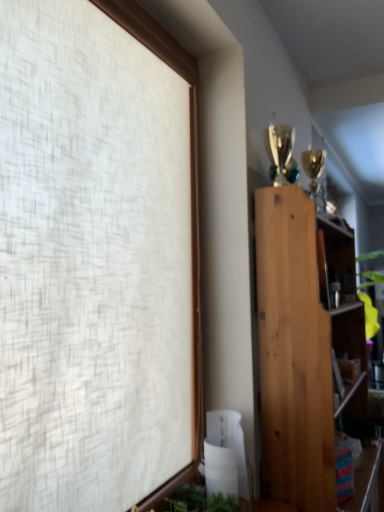
In the scene shown: Measure the distance between green leafy plant at bottom and camera.

green leafy plant at bottom is 4.36 feet from camera.

Identify the location of green leafy plant at bottom. This screenshot has height=512, width=384. (201, 500).

This screenshot has width=384, height=512. What do you see at coordinates (201, 500) in the screenshot?
I see `green leafy plant at bottom` at bounding box center [201, 500].

Describe the element at coordinates (303, 346) in the screenshot. This screenshot has height=512, width=384. I see `natural wood bookcase at right` at that location.

Locate an element on the screen. Image resolution: width=384 pixels, height=512 pixels. natural wood bookcase at right is located at coordinates (303, 346).

Where is `green leafy plant at bottom`? The width and height of the screenshot is (384, 512). green leafy plant at bottom is located at coordinates (201, 500).

Is natural wood bookcase at right to the left of green leafy plant at bottom from the viewer's perspective?

Incorrect, natural wood bookcase at right is not on the left side of green leafy plant at bottom.

From the picture: Is the depth of natural wood bookcase at right greater than that of green leafy plant at bottom?

Yes, natural wood bookcase at right is further from the camera.

Between point (307, 316) and point (189, 490), which one is positioned behind?

The point (307, 316) is more distant.

From the image's perspective, which object appears higher, natural wood bookcase at right or green leafy plant at bottom?

natural wood bookcase at right is shown above in the image.

Based on the photo, from a real-world perspective, is natural wood bookcase at right located beneath green leafy plant at bottom?

Incorrect, from a real-world perspective, natural wood bookcase at right is higher than green leafy plant at bottom.

Is natural wood bookcase at right wider than green leafy plant at bottom?

Yes, natural wood bookcase at right is wider than green leafy plant at bottom.

Considering the sizes of natural wood bookcase at right and green leafy plant at bottom in the image, is natural wood bookcase at right taller or shorter than green leafy plant at bottom?

Considering their sizes, natural wood bookcase at right has more height than green leafy plant at bottom.

Considering the sizes of objects natural wood bookcase at right and green leafy plant at bottom in the image provided, who is smaller, natural wood bookcase at right or green leafy plant at bottom?

green leafy plant at bottom.

Is natural wood bookcase at right inside the boundaries of green leafy plant at bottom, or outside?

natural wood bookcase at right lies outside green leafy plant at bottom.

Is natural wood bookcase at right next to green leafy plant at bottom?

natural wood bookcase at right is not next to green leafy plant at bottom, and they're not touching.

Could you tell me if natural wood bookcase at right is turned towards green leafy plant at bottom?

No, natural wood bookcase at right is not oriented towards green leafy plant at bottom.

How different are the orientations of natural wood bookcase at right and green leafy plant at bottom in degrees?

There is a 1.49-degree angle between the facing directions of natural wood bookcase at right and green leafy plant at bottom.

Measure the distance between natural wood bookcase at right and green leafy plant at bottom.

They are 18.52 inches apart.

Identify the location of bookcase lying behind the green leafy plant at bottom. (303, 346).

Visually, is green leafy plant at bottom positioned to the left or to the right of natural wood bookcase at right?

From the image, it's evident that green leafy plant at bottom is to the left of natural wood bookcase at right.

Which object is further away from the camera taking this photo, green leafy plant at bottom or natural wood bookcase at right?

natural wood bookcase at right is more distant.

Is point (230, 499) less distant than point (328, 469)?

That is True.

From the image's perspective, is green leafy plant at bottom above or below natural wood bookcase at right?

From the image's perspective, green leafy plant at bottom appears below natural wood bookcase at right.

From a real-world perspective, which object rests below the other?

green leafy plant at bottom, from a real-world perspective.

Can you confirm if green leafy plant at bottom is thinner than natural wood bookcase at right?

Yes.

Is green leafy plant at bottom taller or shorter than natural wood bookcase at right?

Clearly, green leafy plant at bottom is shorter compared to natural wood bookcase at right.

In the scene shown: Can you confirm if green leafy plant at bottom is bigger than natural wood bookcase at right?

Incorrect, green leafy plant at bottom is not larger than natural wood bookcase at right.

Is green leafy plant at bottom situated inside natural wood bookcase at right or outside?

green leafy plant at bottom cannot be found inside natural wood bookcase at right.

Consider the image. Does green leafy plant at bottom touch natural wood bookcase at right?

No, green leafy plant at bottom is not in contact with natural wood bookcase at right.

Is green leafy plant at bottom positioned with its back to natural wood bookcase at right?

green leafy plant at bottom does not have its back to natural wood bookcase at right.

This screenshot has width=384, height=512. In the image, there is a green leafy plant at bottom. Identify the location of bookcase above it (from the image's perspective). (303, 346).

I want to click on bookcase located above the green leafy plant at bottom (from the image's perspective), so (x=303, y=346).

Where is `bookcase behind the green leafy plant at bottom`? bookcase behind the green leafy plant at bottom is located at coordinates (303, 346).